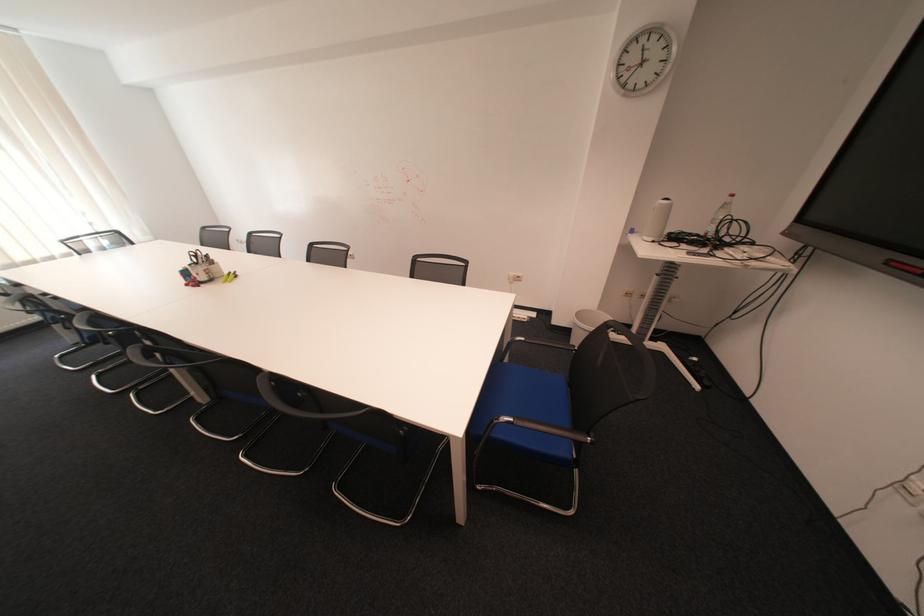
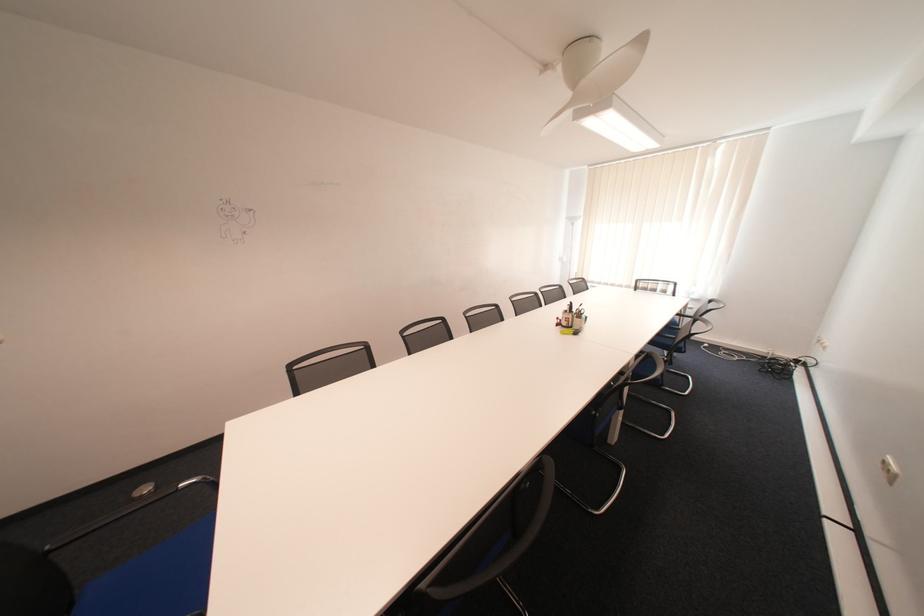
Where in the second image is the point corresponding to point (208, 264) from the first image?

(578, 312)